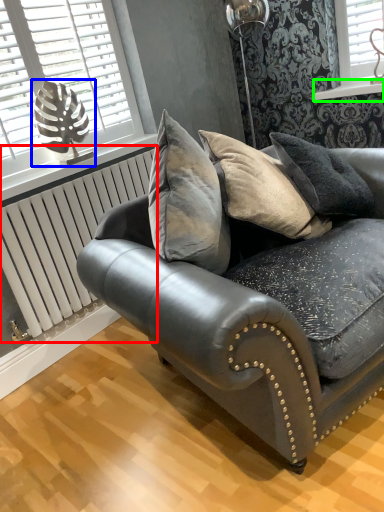
Question: Considering the real-world distances, which object is closest to radiator (highlighted by a red box)? table lamp (highlighted by a blue box) or window sill (highlighted by a green box).

Choices:
 (A) table lamp
 (B) window sill

Answer: (A)